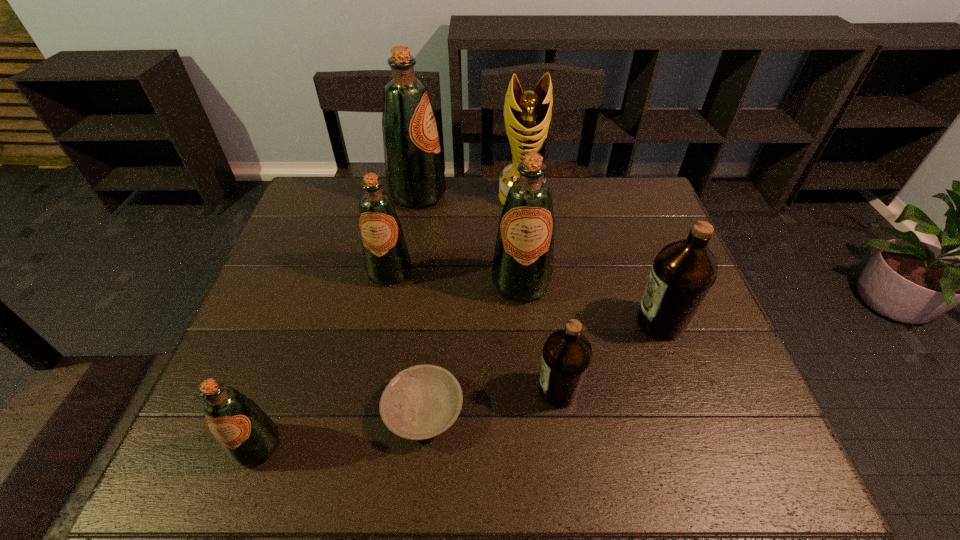
Where is `blank space that satisfies the following two spatial constraints: 1. on the front-facing side of the bowl; 2. on the right side of the third biggest green olive oil`? The image size is (960, 540). blank space that satisfies the following two spatial constraints: 1. on the front-facing side of the bowl; 2. on the right side of the third biggest green olive oil is located at coordinates (361, 411).

Where is `free space that satisfies the following two spatial constraints: 1. on the front-facing side of the shortest object; 2. on the left side of the second smallest green olive oil`? This screenshot has height=540, width=960. free space that satisfies the following two spatial constraints: 1. on the front-facing side of the shortest object; 2. on the left side of the second smallest green olive oil is located at coordinates (361, 411).